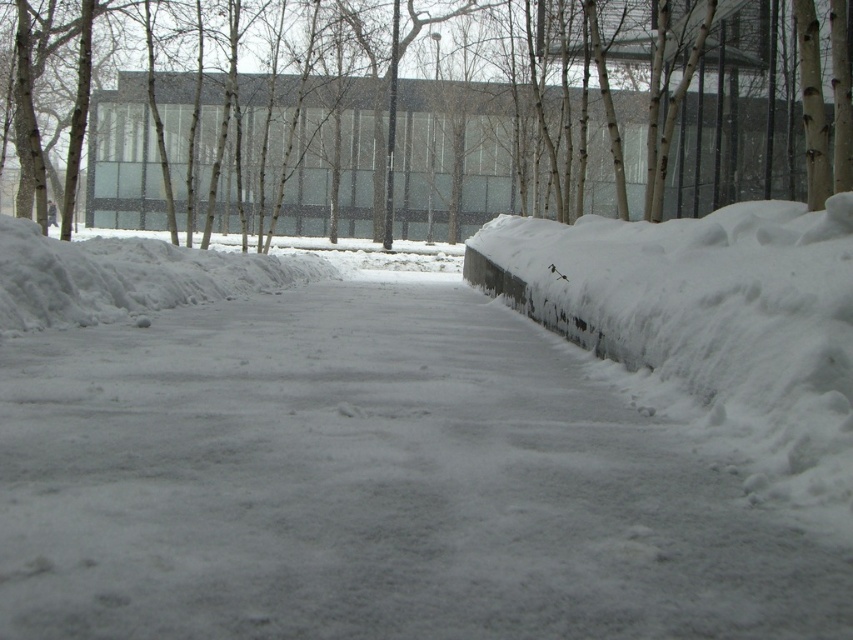
You are standing at the starting point of the snow path and want to reach a destination marked by two points. The first point is at coordinates point [744,97] and the second at point [827,240]. Which point should you head towards first if you want to reach the furthest point from your current position?

You should head towards point [827,240] first because it is closer to you, allowing you to progress further along the path before reaching the point [744,97] which is behind it.

You are standing on the snow covered pathway and want to walk towards the brown smooth tree at upper center. Will you pass by the white fluffy snow at right before reaching the tree?

The brown smooth tree at upper center is closer to you than the white fluffy snow at right, so you will reach the brown smooth tree at upper center before passing by the white fluffy snow at right.